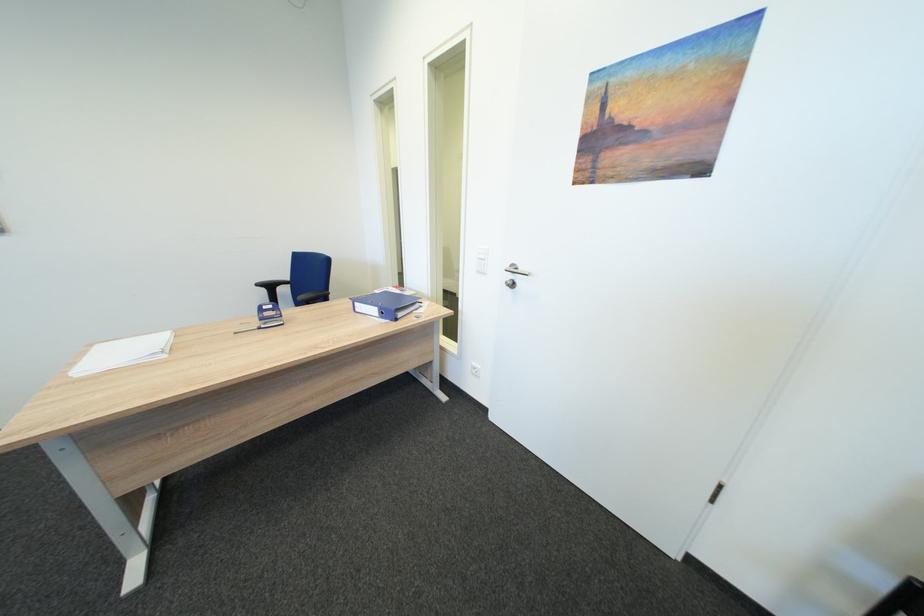
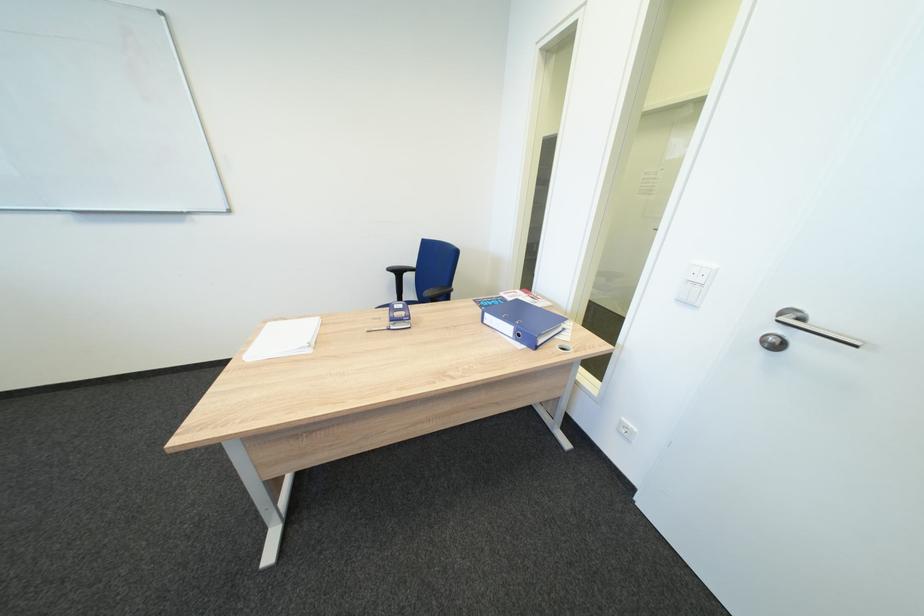
In the second image, find the point that corresponds to (524,286) in the first image.

(784, 346)